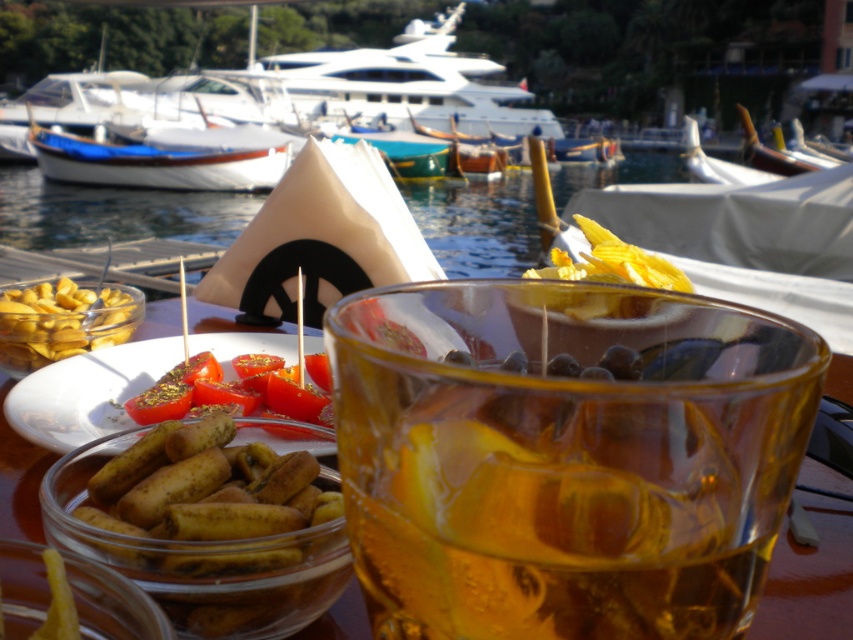
Question: Which object is farther from the camera taking this photo?

Choices:
 (A) yellow matte olives at lower left
 (B) translucent amber liquid at center
 (C) greenish-brown crispy rolls at lower left
 (D) yellow crispy chips at center

Answer: (D)

Question: Is translucent amber liquid at center to the left of tomatocutsliced tomatoes at center from the viewer's perspective?

Choices:
 (A) no
 (B) yes

Answer: (A)

Question: Is greenish-brown crispy rolls at lower left to the right of yellow crispy chips at center from the viewer's perspective?

Choices:
 (A) yes
 (B) no

Answer: (B)

Question: Can you confirm if tomatocutsliced tomatoes at center is wider than yellow crispy chips at center?

Choices:
 (A) no
 (B) yes

Answer: (A)

Question: Which is nearer to the tomatocutsliced tomatoes at center?

Choices:
 (A) yellow matte olives at lower left
 (B) yellow crispy chips at center
 (C) greenish-brown crispy rolls at lower left
 (D) translucent amber liquid at center

Answer: (A)

Question: Estimate the real-world distances between objects in this image. Which object is closer to the tomatocutsliced tomatoes at center?

Choices:
 (A) translucent amber liquid at center
 (B) greenish-brown crispy rolls at lower left
 (C) yellow matte olives at lower left

Answer: (C)